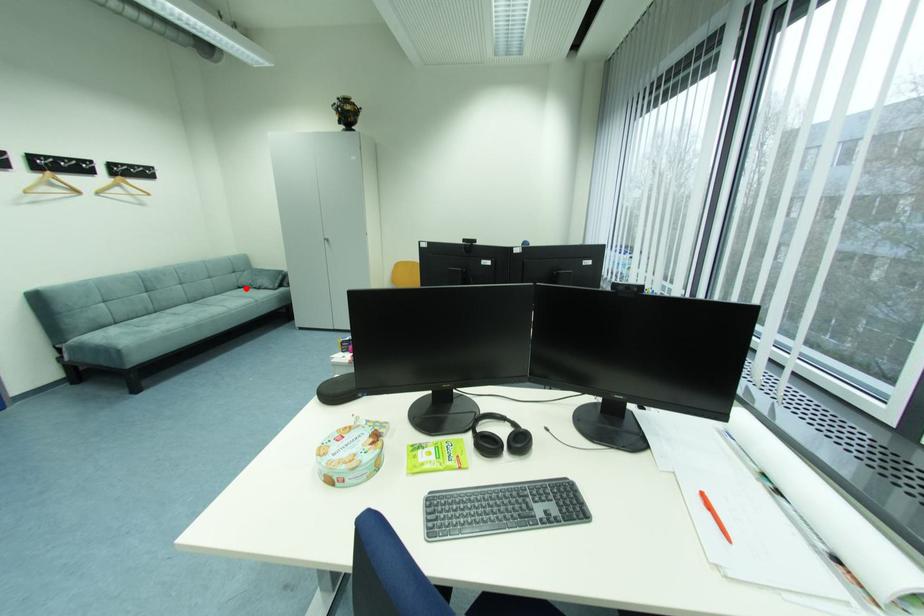
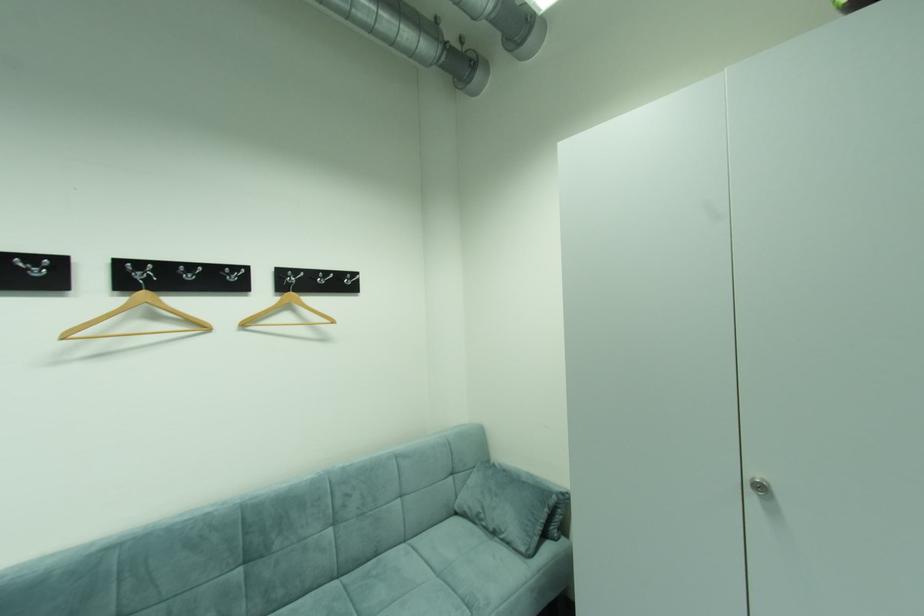
Where in the second image is the point corresponding to the highlighted location from the first image?

(464, 514)